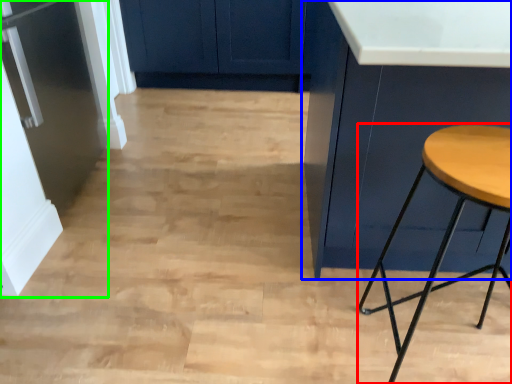
Question: Which object is the closest to the stool (highlighted by a red box)? Choose among these: cabinetry (highlighted by a blue box) or fridge (highlighted by a green box).

Choices:
 (A) cabinetry
 (B) fridge

Answer: (A)